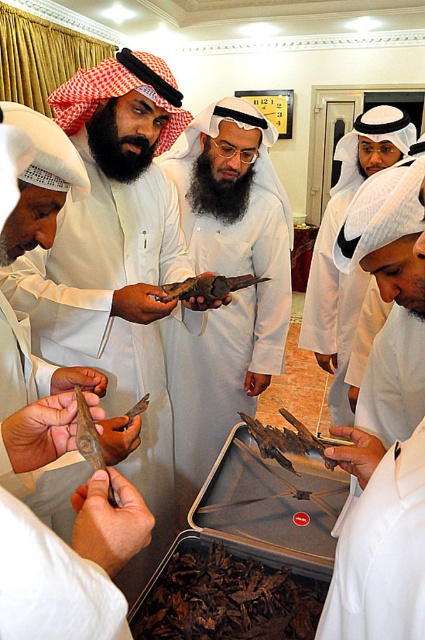
Does white matte robe at center appear over white matte headscarf at center?

No.

Can you confirm if white matte robe at center is bigger than white matte headscarf at center?

Actually, white matte robe at center might be smaller than white matte headscarf at center.

Identify the location of white matte robe at center. (379, 541).

I want to click on white matte robe at center, so click(379, 541).

Is matte brown wooden sword at center behind white matte/soft robe at lower left?

That is True.

Consider the image. Who is lower down, matte brown wooden sword at center or white matte/soft robe at lower left?

Positioned lower is white matte/soft robe at lower left.

Measure the distance between point (183, 161) and camera.

6.79 feet

Where is `matte brown wooden sword at center`? This screenshot has height=640, width=425. matte brown wooden sword at center is located at coordinates (226, 275).

Does matte brown knife at center have a greater height compared to matte brown wooden sword at center?

In fact, matte brown knife at center may be shorter than matte brown wooden sword at center.

From the picture: Is matte brown knife at center above matte brown wooden sword at center?

Actually, matte brown knife at center is below matte brown wooden sword at center.

I want to click on matte brown knife at center, so click(118, 266).